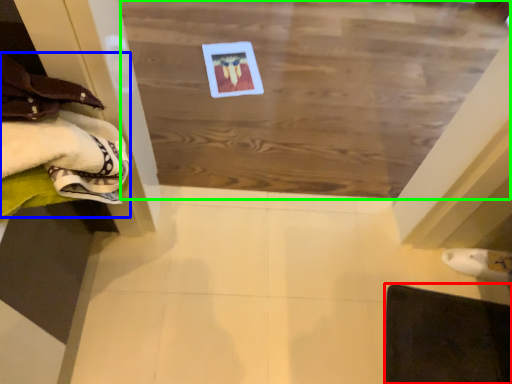
Question: Based on their relative distances, which object is farther from furniture (highlighted by a red box)? Choose from clothing (highlighted by a blue box) and plywood (highlighted by a green box).

Choices:
 (A) clothing
 (B) plywood

Answer: (A)